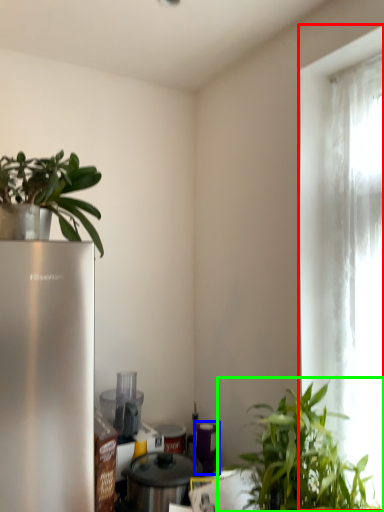
Question: Considering the real-world distances, which object is closest to window (highlighted by a red box)? appliance (highlighted by a blue box) or houseplant (highlighted by a green box).

Choices:
 (A) appliance
 (B) houseplant

Answer: (B)